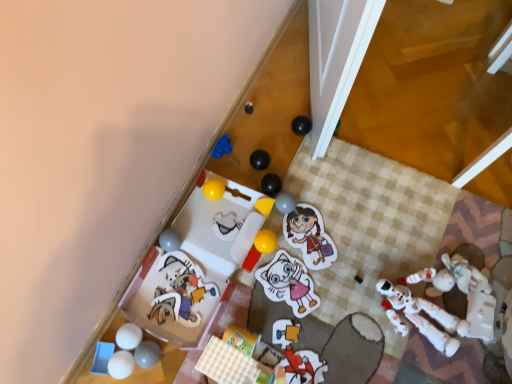
Locate an element on the screen. The height and width of the screenshot is (384, 512). free area in between matte gray ball at lower left, acting as the fourth toy starting from the left, and white matte cat at center, placed as the fourteenth toy when sorted from left to right is located at coordinates (216, 322).